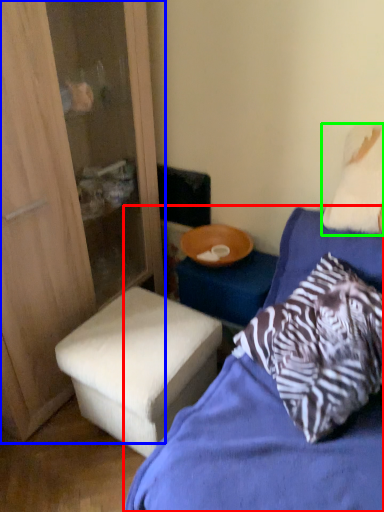
Question: Based on their relative distances, which object is nearer to bed (highlighted by a red box)? Choose from dresser (highlighted by a blue box) and pillow (highlighted by a green box).

Choices:
 (A) dresser
 (B) pillow

Answer: (B)